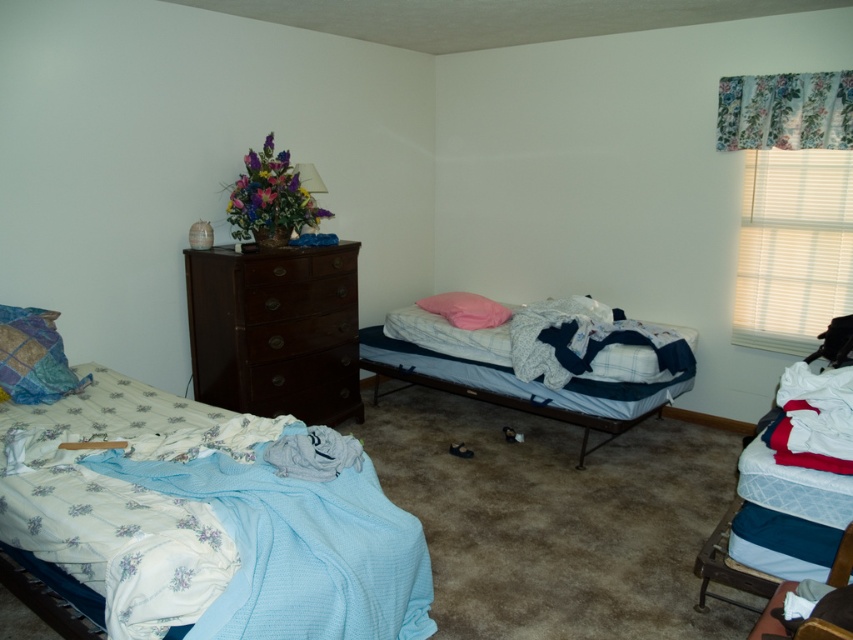
Question: Is dark wood dresser at center wider than quilted fabric pillow at left?

Choices:
 (A) no
 (B) yes

Answer: (B)

Question: Which object is farther from the camera taking this photo?

Choices:
 (A) pink fabric pillow at center
 (B) wooden chair at lower right

Answer: (A)

Question: Which is nearer to the brown wood drawer at center left?

Choices:
 (A) floral-patterned fabric bed at center-left
 (B) brown wood drawer at center

Answer: (B)

Question: Is dark wood dresser at center positioned in front of brown wood drawer at center left?

Choices:
 (A) no
 (B) yes

Answer: (B)

Question: Which of the following is the closest to the observer?

Choices:
 (A) pink fabric pillow at center
 (B) blue fabric bed at center

Answer: (B)

Question: Is blue fabric bed at center below pink fabric pillow at center?

Choices:
 (A) no
 (B) yes

Answer: (B)